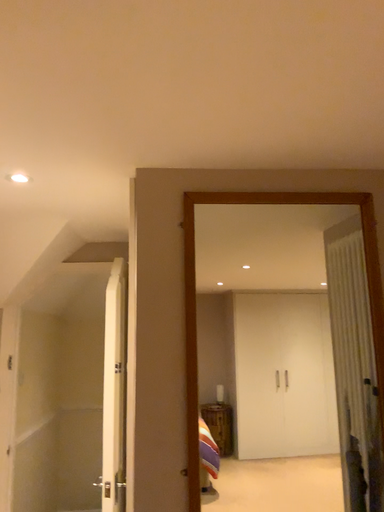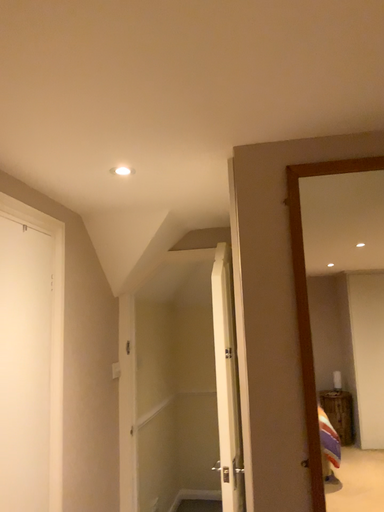
Question: Which way did the camera rotate in the video?

Choices:
 (A) rotated right
 (B) rotated left

Answer: (B)